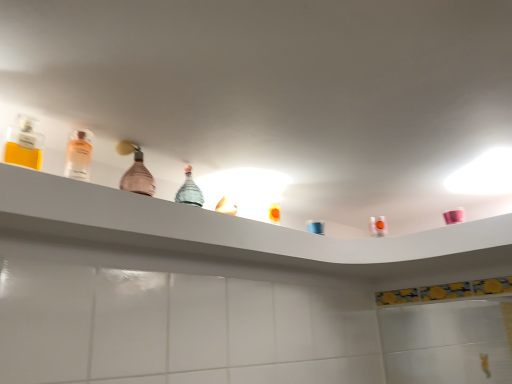
Question: Can you confirm if pink glass bottle at center, which appears as the 3th bottle when viewed from the left, is positioned to the right of clear glass perfume at upper left, the 3th bottle in the right-to-left sequence?

Choices:
 (A) no
 (B) yes

Answer: (B)

Question: Considering the relative positions of pink glass bottle at center, the 3th bottle when ordered from front to back, and clear glass perfume at upper left, which appears as the 1th bottle when viewed from the front, in the image provided, is pink glass bottle at center, the 3th bottle when ordered from front to back, in front of clear glass perfume at upper left, which appears as the 1th bottle when viewed from the front,?

Choices:
 (A) no
 (B) yes

Answer: (A)

Question: Can you confirm if pink glass bottle at center, the 3th bottle when ordered from front to back, is shorter than clear glass perfume at upper left, the 3th bottle positioned from the back?

Choices:
 (A) yes
 (B) no

Answer: (B)

Question: Is pink glass bottle at center, the 3th bottle when ordered from front to back, smaller than clear glass perfume at upper left, which appears as the 1th bottle when viewed from the front?

Choices:
 (A) yes
 (B) no

Answer: (B)

Question: Is pink glass bottle at center, arranged as the 1th bottle when viewed from the back, next to clear glass perfume at upper left, positioned as the 1th bottle in left-to-right order, and touching it?

Choices:
 (A) yes
 (B) no

Answer: (B)

Question: Is point (67, 147) positioned closer to the camera than point (270, 231)?

Choices:
 (A) farther
 (B) closer

Answer: (B)

Question: In the image, is clear glass bottle at left, acting as the second bottle starting from the right, positioned in front of or behind matte glass bottles at upper center?

Choices:
 (A) front
 (B) behind

Answer: (B)

Question: From a real-world perspective, is clear glass bottle at left, the 2th bottle when ordered from front to back, physically located above or below matte glass bottles at upper center?

Choices:
 (A) below
 (B) above

Answer: (B)

Question: In terms of width, does clear glass bottle at left, the 2th bottle when ordered from front to back, look wider or thinner when compared to matte glass bottles at upper center?

Choices:
 (A) wide
 (B) thin

Answer: (B)

Question: Considering the positions of clear glass bottle at left, the 2th bottle when ordered from front to back, and pink glass bottle at center, the 1th bottle from the right, in the image, is clear glass bottle at left, the 2th bottle when ordered from front to back, wider or thinner than pink glass bottle at center, the 1th bottle from the right,?

Choices:
 (A) thin
 (B) wide

Answer: (A)

Question: In the image, is clear glass bottle at left, the second bottle from the back, on the left side or the right side of pink glass bottle at center, the 1th bottle from the right?

Choices:
 (A) left
 (B) right

Answer: (A)

Question: From a real-world perspective, is clear glass bottle at left, acting as the second bottle starting from the right, physically located above or below pink glass bottle at center, arranged as the 1th bottle when viewed from the back?

Choices:
 (A) below
 (B) above

Answer: (A)

Question: Is clear glass bottle at left, the second bottle from the back, bigger or smaller than pink glass bottle at center, arranged as the 1th bottle when viewed from the back?

Choices:
 (A) small
 (B) big

Answer: (A)

Question: Based on their sizes in the image, would you say pink glass bottle at center, the 1th bottle from the right, is bigger or smaller than matte glass bottles at upper center?

Choices:
 (A) small
 (B) big

Answer: (A)

Question: From a real-world perspective, relative to matte glass bottles at upper center, is pink glass bottle at center, which appears as the 3th bottle when viewed from the left, vertically above or below?

Choices:
 (A) below
 (B) above

Answer: (B)